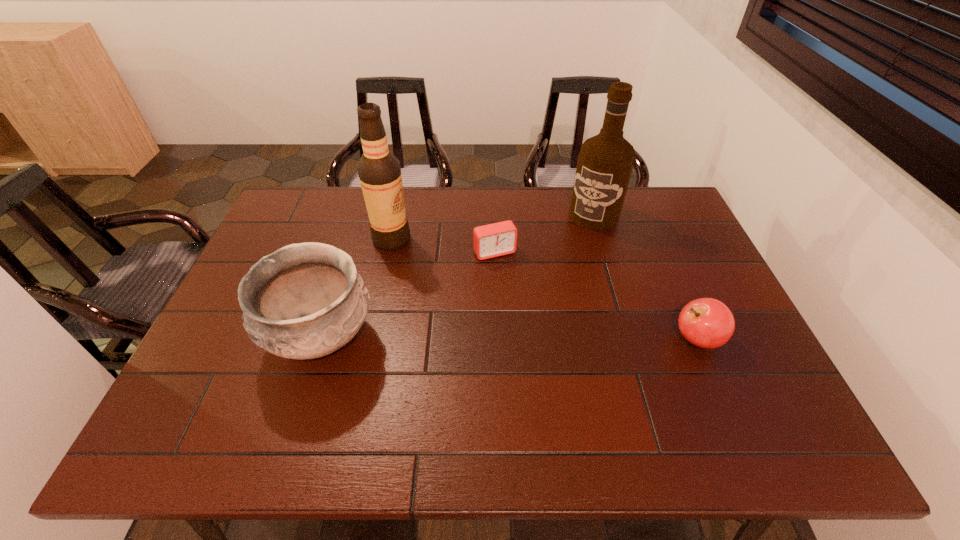
The width and height of the screenshot is (960, 540). In order to click on free region located 0.160m on the label of the right alcohol in this screenshot , I will do `click(564, 256)`.

At what (x,y) coordinates should I click in order to perform the action: click on vacant space located 0.200m on the label of the right alcohol. Please return your answer as a coordinate pair (x, y). Looking at the image, I should click on (559, 265).

This screenshot has width=960, height=540. Find the location of `vacant space situated on the label of the left alcohol`. vacant space situated on the label of the left alcohol is located at coordinates (465, 298).

Where is `free region located on the label of the left alcohol`? free region located on the label of the left alcohol is located at coordinates (418, 260).

This screenshot has height=540, width=960. What are the coordinates of `vacant point located 0.220m on the label of the left alcohol` in the screenshot? It's located at (450, 286).

Locate an element on the screen. free space located 0.180m on the front-facing side of the shortest object is located at coordinates point(525,305).

Image resolution: width=960 pixels, height=540 pixels. Find the location of `free space located on the front-facing side of the shortest object`. free space located on the front-facing side of the shortest object is located at coordinates (508, 273).

The width and height of the screenshot is (960, 540). In order to click on free space located on the front-facing side of the shortest object in this screenshot , I will do `click(553, 357)`.

I want to click on object located in the near edge section of the desktop, so click(304, 301).

The image size is (960, 540). In order to click on object situated at the left edge in this screenshot , I will do `click(304, 301)`.